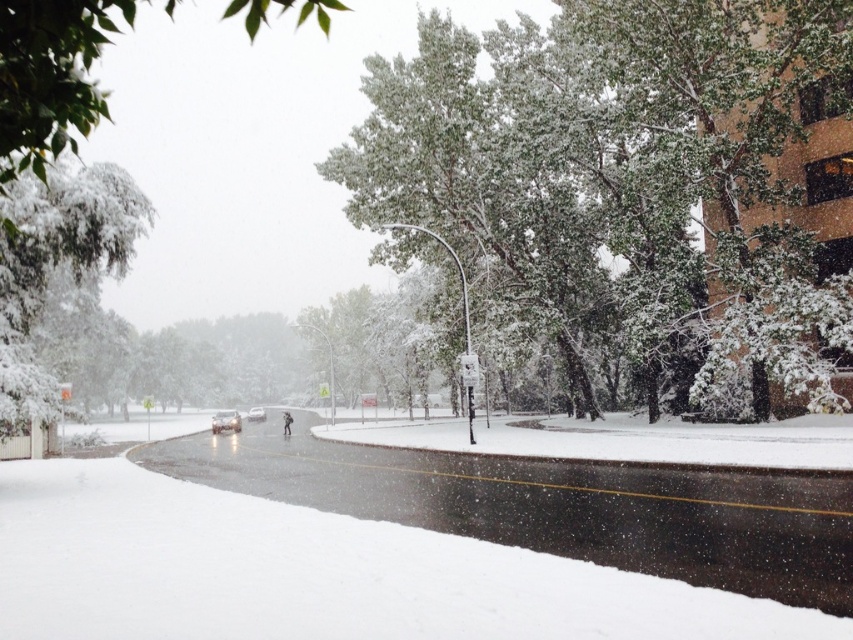
Between snow-covered tree at center and glossy metallic car at center, which one has less height?

glossy metallic car at center is shorter.

Who is lower down, snow-covered tree at center or glossy metallic car at center?

Positioned lower is glossy metallic car at center.

Where is `snow-covered tree at center`? This screenshot has width=853, height=640. snow-covered tree at center is located at coordinates [x=628, y=179].

The width and height of the screenshot is (853, 640). I want to click on snow-covered tree at center, so click(628, 179).

Between snow-covered tree at center and green leafy tree at upper left, which one has less height?

snow-covered tree at center is shorter.

Where is `snow-covered tree at center`? This screenshot has height=640, width=853. snow-covered tree at center is located at coordinates (628, 179).

Is green leafy tree at upper left smaller than glossy metallic car at center?

Incorrect, green leafy tree at upper left is not smaller in size than glossy metallic car at center.

Which of these two, green leafy tree at upper left or glossy metallic car at center, stands shorter?

glossy metallic car at center is shorter.

Between point (0, 192) and point (218, 428), which one is positioned behind?

Point (218, 428)

Where is `green leafy tree at upper left`? green leafy tree at upper left is located at coordinates (50, 77).